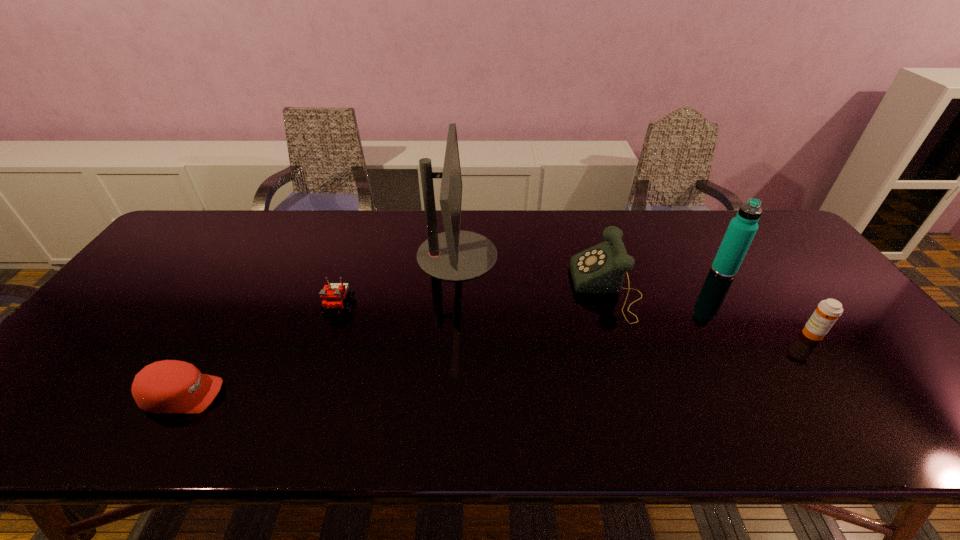
Locate an element on the screen. The image size is (960, 540). free space that is in between the water bottle and the third shortest object is located at coordinates (767, 302).

You are a GUI agent. You are given a task and a screenshot of the screen. Output one action in this format:
    pyautogui.click(x=<x>, y=<y>)
    Task: Click on the free space between the second nearest object and the fifth object from right to left
    The height and width of the screenshot is (540, 960).
    Given the screenshot: What is the action you would take?
    pyautogui.click(x=575, y=321)

The image size is (960, 540). Find the location of `free space between the leftmost object and the third object from left to right`. free space between the leftmost object and the third object from left to right is located at coordinates (321, 325).

Where is `empty location between the second tallest object and the cap`? Image resolution: width=960 pixels, height=540 pixels. empty location between the second tallest object and the cap is located at coordinates (454, 333).

Find the location of a particular element. The image size is (960, 540). vacant space in between the medicine and the computer monitor is located at coordinates (635, 294).

The image size is (960, 540). Identify the location of vacant space that's between the third object from right to left and the leftmost object. (396, 342).

Where is `free spot between the second object from left to right and the computer monitor`? free spot between the second object from left to right and the computer monitor is located at coordinates (398, 281).

Identify which object is located as the second nearest to the Lego. Please provide its 2D coordinates. Your answer should be formatted as a tuple, i.e. [(x, y)], where the tuple contains the x and y coordinates of a point satisfying the conditions above.

[(170, 386)]

Select which object appears as the fourth closest to the fourth tallest object. Please provide its 2D coordinates. Your answer should be formatted as a tuple, i.e. [(x, y)], where the tuple contains the x and y coordinates of a point satisfying the conditions above.

[(333, 295)]

Find the location of a particular element. vacant position in the image that satisfies the following two spatial constraints: 1. on the screen of the fourth tallest object; 2. on the right side of the third object from left to right is located at coordinates (452, 334).